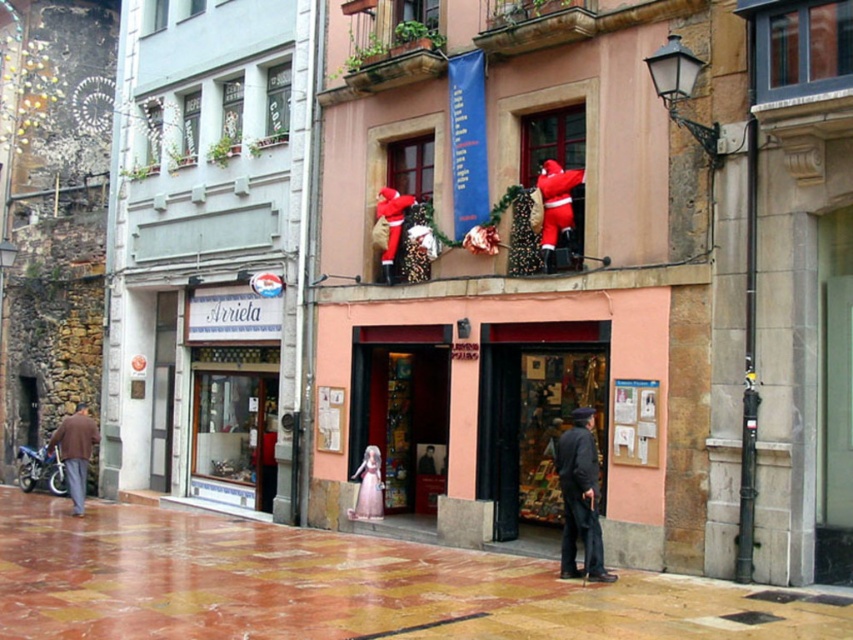
You are a tailor visiting the quaint European town and need to determine which garment is more suitable for a client who prefers a compact and less bulky winter outfit. Based on the scene, which item between the dark gray wool coat at lower center and the brown woolen jacket at lower left would you recommend?

The dark gray wool coat at lower center has a smaller size compared to the brown woolen jacket at lower left, making it more compact and less bulky. Therefore, the dark gray wool coat at lower center would be the better recommendation for the client.

You are a tourist standing in the middle of the street and want to buy a souvenir. You see the dark gray wool coat at lower center and the velvet red santa at upper right. Which object is closer to your right side?

The dark gray wool coat at lower center is positioned on the right side of velvet red santa at upper right, so it is closer to your right side.